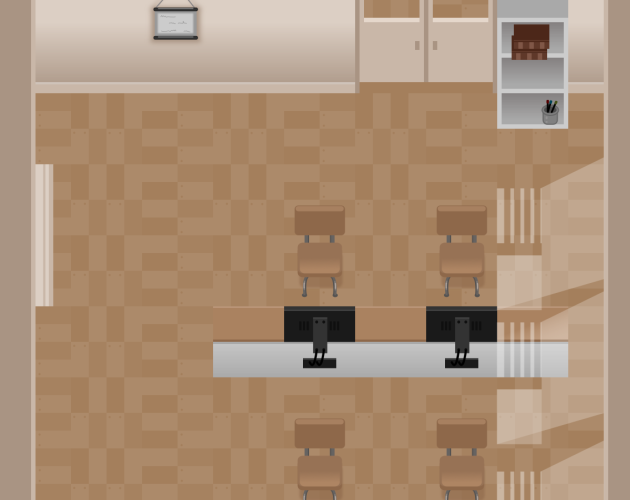
Identify the location of chairs. The width and height of the screenshot is (630, 500). (321, 258), (457, 254), (450, 468), (312, 462).